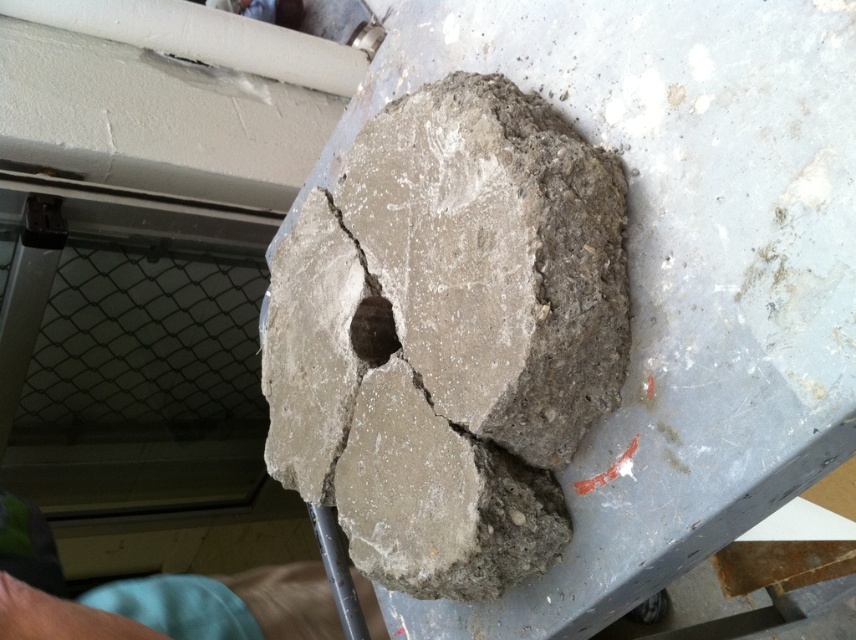
Question: Among these points, which one is nearest to the camera?

Choices:
 (A) (244, 579)
 (B) (663, 0)

Answer: (B)

Question: Is skinny blue shorts at lower left below dark gray concrete hole at center?

Choices:
 (A) no
 (B) yes

Answer: (B)

Question: Which of the following is the closest to the observer?

Choices:
 (A) (316, 624)
 (B) (377, 310)

Answer: (B)

Question: Which object is the farthest from the dark gray concrete hole at center?

Choices:
 (A) gray concrete at center
 (B) skinny blue shorts at lower left

Answer: (B)

Question: Is gray concrete at center to the left of dark gray concrete hole at center from the viewer's perspective?

Choices:
 (A) yes
 (B) no

Answer: (B)

Question: Is gray concrete at center bigger than skinny blue shorts at lower left?

Choices:
 (A) no
 (B) yes

Answer: (B)